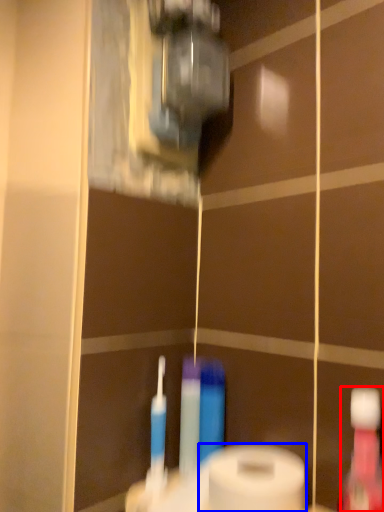
Question: Among these objects, which one is farthest to the camera, mouthwash (highlighted by a red box) or toilet paper (highlighted by a blue box)?

Choices:
 (A) mouthwash
 (B) toilet paper

Answer: (B)